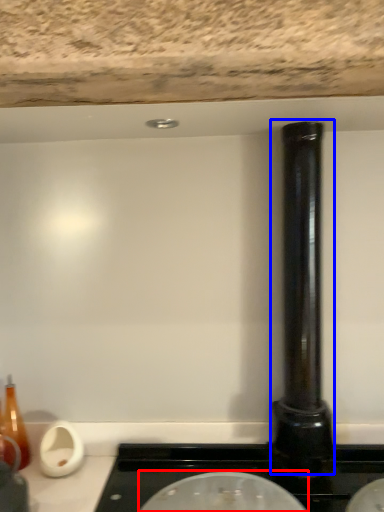
Question: Which object appears farthest to the camera in this image, appliance (highlighted by a red box) or pillar (highlighted by a blue box)?

Choices:
 (A) appliance
 (B) pillar

Answer: (B)